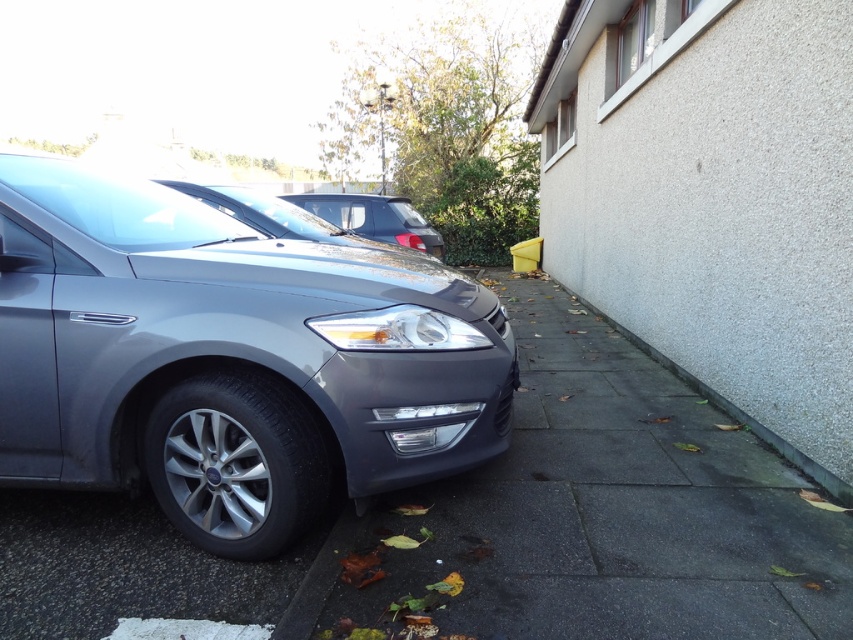
Question: Which point appears closest to the camera in this image?

Choices:
 (A) (822, 468)
 (B) (378, 232)

Answer: (A)

Question: Among these points, which one is nearest to the camera?

Choices:
 (A) (364, 193)
 (B) (747, 516)
 (C) (650, 348)
 (D) (82, 166)

Answer: (B)

Question: Is satin black minivan at center smaller than gray concrete curb at lower right?

Choices:
 (A) no
 (B) yes

Answer: (A)

Question: Is gray concrete pavement at center above satin black minivan at center?

Choices:
 (A) yes
 (B) no

Answer: (B)

Question: Which object is the farthest from the gray concrete curb at lower right?

Choices:
 (A) gray concrete pavement at center
 (B) satin black minivan at center
 (C) satin metallic car at left

Answer: (B)

Question: Does satin black minivan at center appear under gray concrete curb at lower right?

Choices:
 (A) no
 (B) yes

Answer: (A)